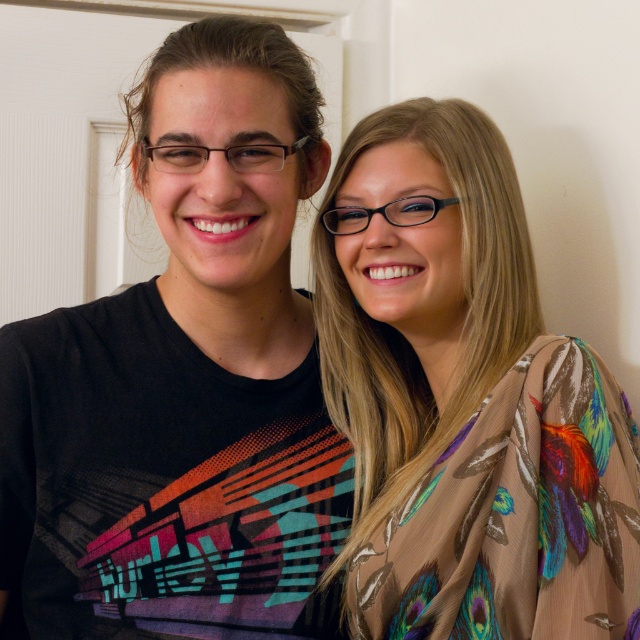
Can you confirm if black matte t-shirt at left is thinner than multicolored feathered scarf at center?

No.

In the scene shown: Is black matte t-shirt at left taller than multicolored feathered scarf at center?

Indeed, black matte t-shirt at left has a greater height compared to multicolored feathered scarf at center.

Measure the distance between black matte t-shirt at left and camera.

black matte t-shirt at left and camera are 30.39 inches apart from each other.

Identify the location of black matte t-shirt at left. This screenshot has width=640, height=640. (186, 380).